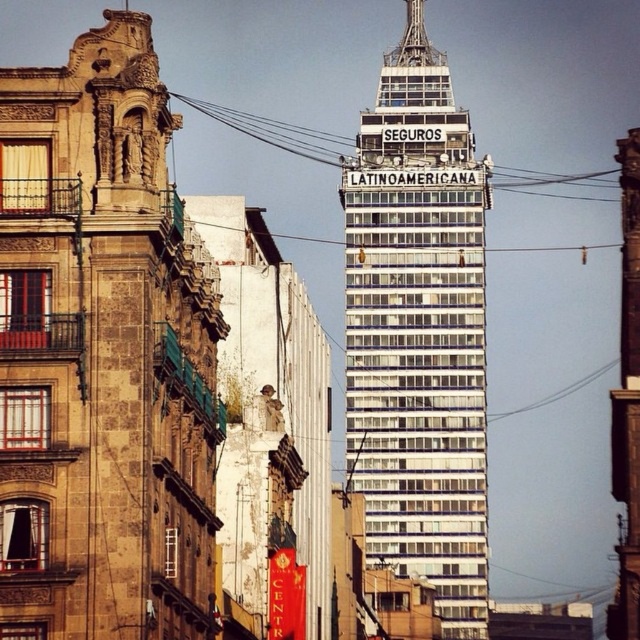
Consider the image. You are an urban planner reviewing this cityscape. You need to determine if the brown stone building at left could be seen from the top floor of the white glass building at center. Based on their positions, can you confirm visibility?

The brown stone building at left is below the white glass building at center, so from the top floor of the white glass building at center, you would likely have a clear view of the brown stone building at left since it is positioned lower.

You are a city planner reviewing the urban layout. You need to determine the spatial relationship between the brown stone building at left and the white glass building at center. Which building is located to the east of the other?

The brown stone building at left is positioned on the left side of white glass building at center, so the brown stone building at left is to the east of the white glass building at center.